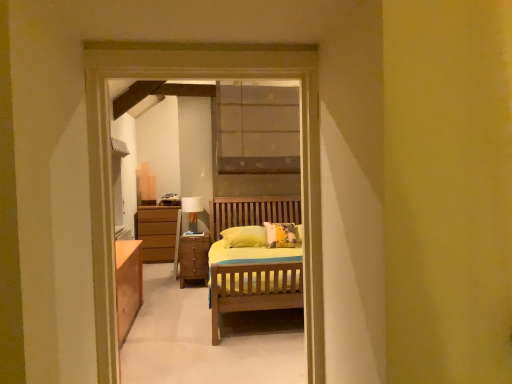
Question: From a real-world perspective, is white fabric-covered table lamp at center physically located above or below wooden chest of drawers at center?

Choices:
 (A) below
 (B) above

Answer: (B)

Question: Is white fabric-covered table lamp at center inside the boundaries of wooden chest of drawers at center, or outside?

Choices:
 (A) inside
 (B) outside

Answer: (B)

Question: Is white fabric-covered table lamp at center to the left or to the right of wooden chest of drawers at center in the image?

Choices:
 (A) left
 (B) right

Answer: (A)

Question: Considering the positions of wooden chest of drawers at center and white fabric-covered table lamp at center in the image, is wooden chest of drawers at center bigger or smaller than white fabric-covered table lamp at center?

Choices:
 (A) small
 (B) big

Answer: (B)

Question: In the image, is wooden chest of drawers at center on the left side or the right side of white fabric-covered table lamp at center?

Choices:
 (A) left
 (B) right

Answer: (B)

Question: Choose the correct answer: Is wooden chest of drawers at center inside white fabric-covered table lamp at center or outside it?

Choices:
 (A) inside
 (B) outside

Answer: (B)

Question: From the image's perspective, is wooden chest of drawers at center positioned above or below white fabric-covered table lamp at center?

Choices:
 (A) above
 (B) below

Answer: (B)